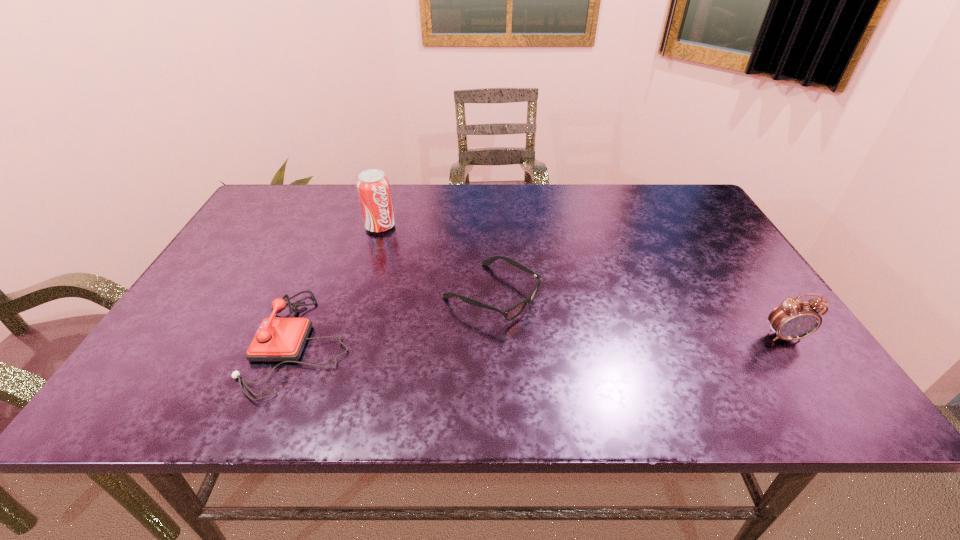
Identify the location of vacant region at the far edge of the desktop. (609, 192).

In the image, there is a desktop. In order to click on vacant space at the near edge in this screenshot , I will do `click(340, 372)`.

You are a GUI agent. You are given a task and a screenshot of the screen. Output one action in this format:
    pyautogui.click(x=<x>, y=<y>)
    Task: Click on the free space at the left edge of the desktop
    This screenshot has width=960, height=540.
    Given the screenshot: What is the action you would take?
    pyautogui.click(x=230, y=323)

I want to click on vacant region at the far left corner of the desktop, so click(258, 215).

The width and height of the screenshot is (960, 540). In the image, there is a desktop. In order to click on blank space at the far right corner in this screenshot , I will do `click(684, 210)`.

Locate an element on the screen. The image size is (960, 540). vacant position at the near right corner of the desktop is located at coordinates (x=750, y=350).

The image size is (960, 540). I want to click on vacant area that lies between the third shortest object and the telephone, so click(542, 339).

You are a GUI agent. You are given a task and a screenshot of the screen. Output one action in this format:
    pyautogui.click(x=<x>, y=<y>)
    Task: Click on the unoccupied area between the rightmost object and the shortest object
    
    Given the screenshot: What is the action you would take?
    pyautogui.click(x=637, y=315)

Identify the location of vacant space that is in between the telephone and the soda can. The height and width of the screenshot is (540, 960). (341, 285).

Identify the location of free space between the spectacles and the soda can. (436, 260).